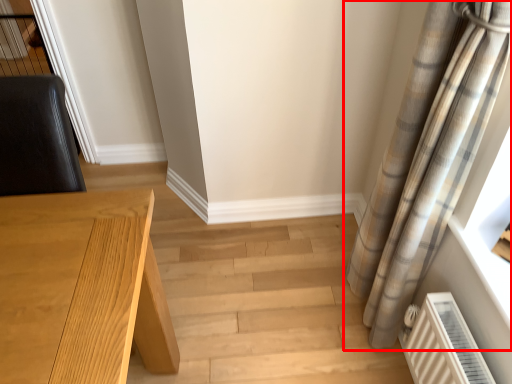
Question: From the image's perspective, what is the correct spatial relationship of curtain (annotated by the red box) in relation to table?

Choices:
 (A) above
 (B) below

Answer: (A)